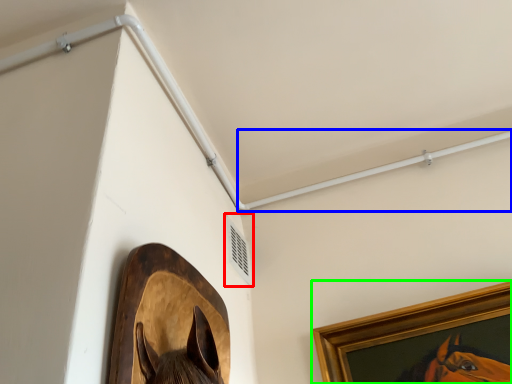
Question: Considering the real-world distances, which object is farthest from air conditioning (highlighted by a red box)? beam (highlighted by a blue box) or picture frame (highlighted by a green box)?

Choices:
 (A) beam
 (B) picture frame

Answer: (B)